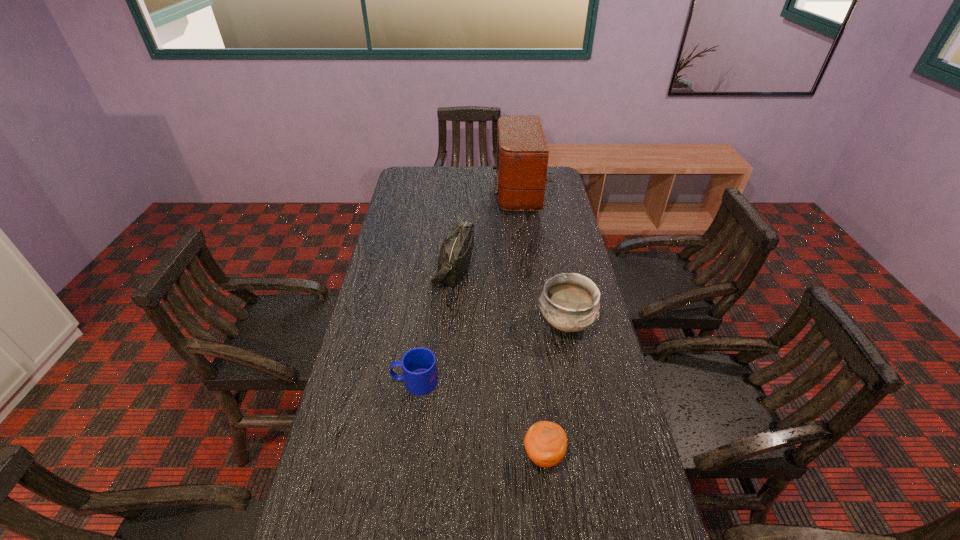
Locate an element on the screen. blank region between the second tallest object and the radio receiver is located at coordinates (491, 231).

Locate an element on the screen. The width and height of the screenshot is (960, 540). vacant space that's between the tallest object and the third tallest object is located at coordinates (547, 258).

Locate an element on the screen. free spot between the shortest object and the orange is located at coordinates (479, 418).

The image size is (960, 540). I want to click on vacant space in between the mug and the second farthest object, so click(x=434, y=325).

I want to click on object that stands as the fourth closest to the mug, so pos(522,152).

Locate an element on the screen. object that is the third closest one to the second tallest object is located at coordinates (418, 364).

Image resolution: width=960 pixels, height=540 pixels. In order to click on vacant region that satisfies the following two spatial constraints: 1. on the side with the handle of the nearest object; 2. on the right side of the shortest object in this screenshot , I will do `click(405, 455)`.

You are a GUI agent. You are given a task and a screenshot of the screen. Output one action in this format:
    pyautogui.click(x=<x>, y=<y>)
    Task: Click on the vacant area that satisfies the following two spatial constraints: 1. on the front panel of the radio receiver; 2. on the right side of the third tallest object
    
    Given the screenshot: What is the action you would take?
    pyautogui.click(x=550, y=323)

I want to click on free space that satisfies the following two spatial constraints: 1. on the front panel of the farthest object; 2. on the right side of the third nearest object, so click(x=550, y=323).

The height and width of the screenshot is (540, 960). In order to click on vacant area in the image that satisfies the following two spatial constraints: 1. at the front padded panel of the pottery; 2. on the right side of the shoulder bag in this screenshot , I will do `click(449, 323)`.